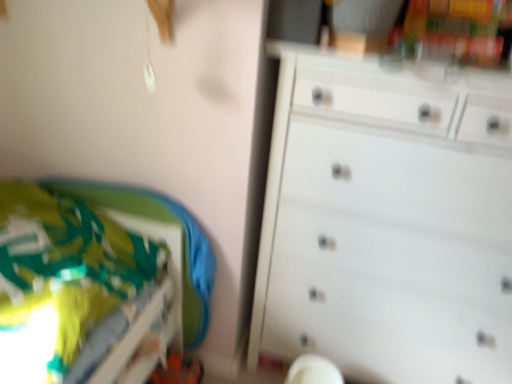
Question: Would you consider green fabric bed at lower left to be distant from white matte chest of drawers at right?

Choices:
 (A) yes
 (B) no

Answer: (B)

Question: Is white matte chest of drawers at right at the back of green fabric bed at lower left?

Choices:
 (A) yes
 (B) no

Answer: (B)

Question: Does green fabric bed at lower left have a larger size compared to white matte chest of drawers at right?

Choices:
 (A) no
 (B) yes

Answer: (A)

Question: Is white matte chest of drawers at right located within green fabric bed at lower left?

Choices:
 (A) yes
 (B) no

Answer: (B)

Question: Does green fabric bed at lower left have a lesser height compared to white matte chest of drawers at right?

Choices:
 (A) yes
 (B) no

Answer: (A)

Question: Could you tell me if green fabric bed at lower left is turned towards white matte chest of drawers at right?

Choices:
 (A) no
 (B) yes

Answer: (A)

Question: Can you confirm if white matte chest of drawers at right is smaller than green fabric bed at lower left?

Choices:
 (A) no
 (B) yes

Answer: (A)

Question: Are white matte chest of drawers at right and green fabric bed at lower left beside each other?

Choices:
 (A) no
 (B) yes

Answer: (A)

Question: Is white matte chest of drawers at right closer to the viewer compared to green fabric bed at lower left?

Choices:
 (A) yes
 (B) no

Answer: (B)

Question: From a real-world perspective, is white matte chest of drawers at right positioned over green fabric bed at lower left based on gravity?

Choices:
 (A) no
 (B) yes

Answer: (B)

Question: Is white matte chest of drawers at right far away from green fabric bed at lower left?

Choices:
 (A) yes
 (B) no

Answer: (B)

Question: Is white matte chest of drawers at right at the left side of green fabric bed at lower left?

Choices:
 (A) yes
 (B) no

Answer: (B)

Question: Could green fabric bed at lower left be considered to be inside white plastic swivel chair at lower center?

Choices:
 (A) no
 (B) yes

Answer: (A)